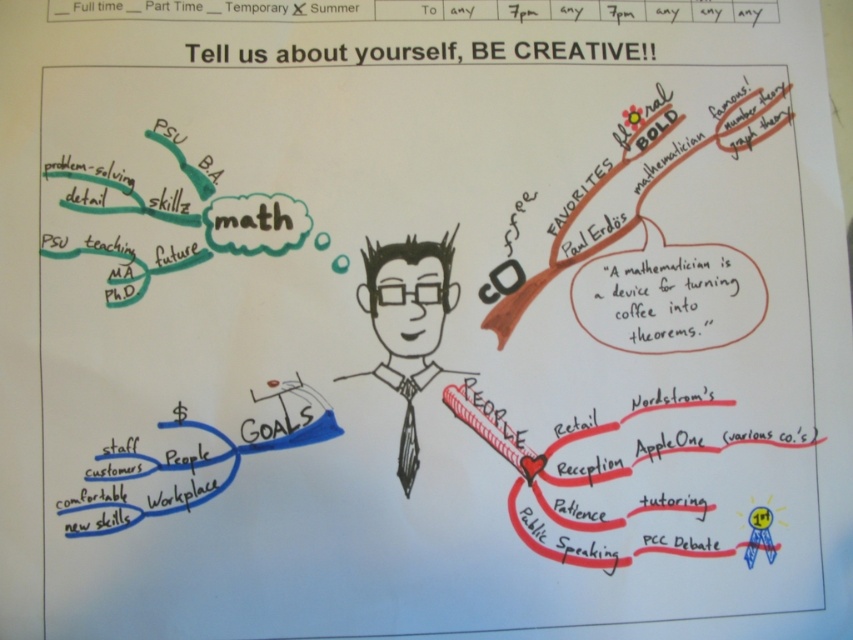
Looking at the mind map, which object is positioned to the left of the other between the black ink drawing of man at center and the black silk tie at center?

The black ink drawing of man at center is to the left of the black silk tie at center.

You are an art student analyzing the mind map. You notice the black ink drawing of man at center and the black silk tie at center. Which object appears closer to you in the drawing?

The black ink drawing of man at center appears closer to you because it is positioned in front of the black silk tie at center, making the tie seem farther away.